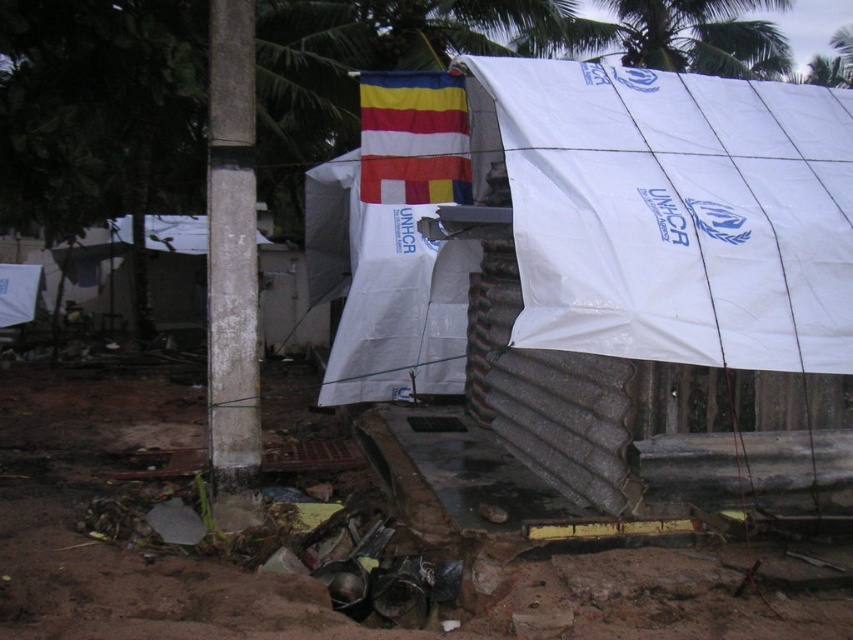
Question: Which point is closer to the camera?

Choices:
 (A) white plastic tent at upper center
 (B) brown dirt at lower left
 (C) white concrete pole at center

Answer: (B)

Question: Which point is farther to the camera?

Choices:
 (A) brown dirt at lower left
 (B) striped fabric flag at upper center
 (C) white concrete pole at center
 (D) white plastic tent at upper center

Answer: (D)

Question: Does white plastic tent at upper center have a greater width compared to white concrete pole at center?

Choices:
 (A) yes
 (B) no

Answer: (B)

Question: Which point is closer to the camera?

Choices:
 (A) (405, 100)
 (B) (769, 632)

Answer: (B)

Question: Is white concrete pole at center wider than striped fabric flag at upper center?

Choices:
 (A) yes
 (B) no

Answer: (B)

Question: Can you confirm if white plastic tent at upper center is positioned below white concrete pole at center?

Choices:
 (A) no
 (B) yes

Answer: (A)